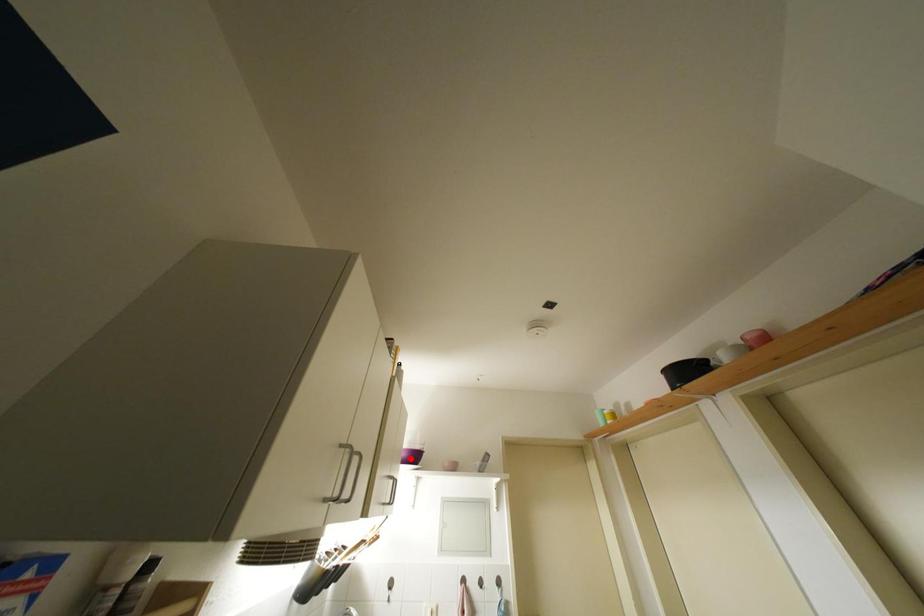
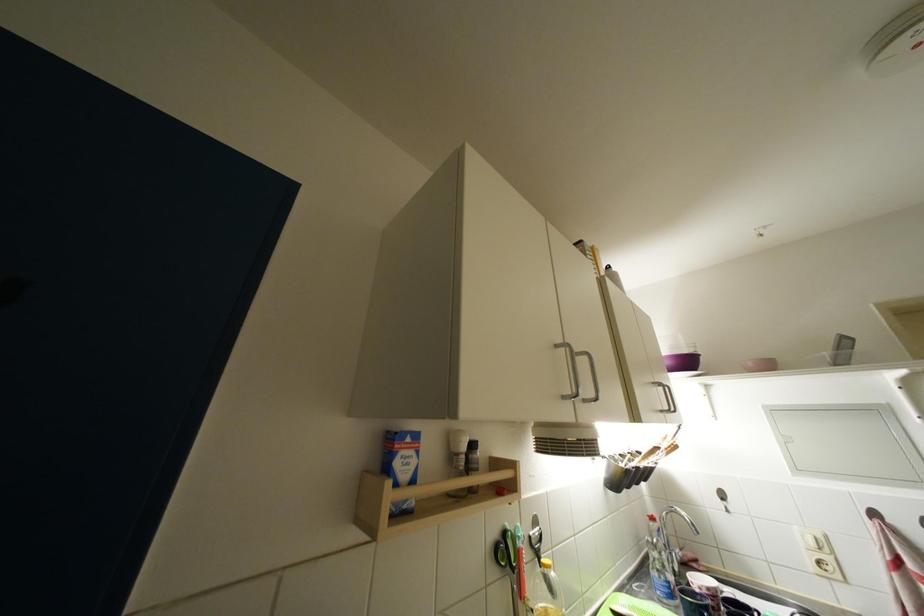
Where in the second image is the point corresponding to the highlighted location from the first image?

(675, 367)